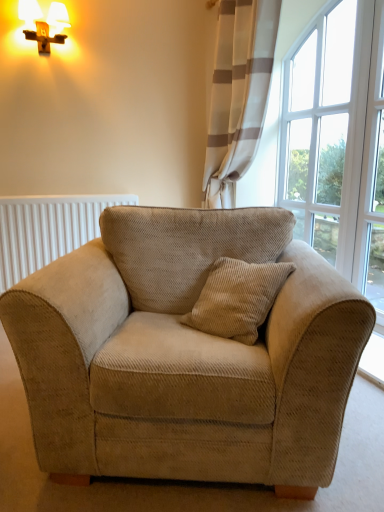
You are a GUI agent. You are given a task and a screenshot of the screen. Output one action in this format:
    pyautogui.click(x=<x>, y=<y>)
    Task: Click on the clear glass window at upper right
    The image size is (384, 512).
    Given the screenshot: What is the action you would take?
    coord(339,149)

The width and height of the screenshot is (384, 512). What do you see at coordinates (339, 149) in the screenshot?
I see `clear glass window at upper right` at bounding box center [339, 149].

What do you see at coordinates (44, 23) in the screenshot? I see `matte gold table lamp at upper left` at bounding box center [44, 23].

This screenshot has height=512, width=384. I want to click on clear glass window at upper right, so click(x=339, y=149).

Is white textured curtain at upper right outside of beige corduroy armchair at center?

Yes, white textured curtain at upper right is not within beige corduroy armchair at center.

Is white textured curtain at upper right facing away from beige corduroy armchair at center?

white textured curtain at upper right does not have its back to beige corduroy armchair at center.

From the image's perspective, is white textured curtain at upper right positioned above or below beige corduroy armchair at center?

white textured curtain at upper right is above beige corduroy armchair at center.

Locate an element on the screen. Image resolution: width=384 pixels, height=512 pixels. curtain on the right of beige corduroy armchair at center is located at coordinates (238, 94).

Measure the distance from beige corduroy armchair at center to white ribbed radiator at left.

They are 4.78 feet apart.

Is beige corduroy armchair at center taller or shorter than white ribbed radiator at left?

beige corduroy armchair at center is taller than white ribbed radiator at left.

Which object is positioned more to the right, beige corduroy armchair at center or white ribbed radiator at left?

From the viewer's perspective, beige corduroy armchair at center appears more on the right side.

From a real-world perspective, which is physically below, clear glass window at upper right or beige corduroy armchair at center?

From a 3D spatial view, beige corduroy armchair at center is below.

Is clear glass window at upper right aimed at beige corduroy armchair at center?

No, clear glass window at upper right is not turned towards beige corduroy armchair at center.

Is clear glass window at upper right shorter than beige corduroy armchair at center?

No.

Based on the photo, does white textured curtain at upper right touch clear glass window at upper right?

white textured curtain at upper right is not next to clear glass window at upper right, and they're not touching.

In terms of height, does white textured curtain at upper right look taller or shorter compared to clear glass window at upper right?

Considering their sizes, white textured curtain at upper right has less height than clear glass window at upper right.

From a real-world perspective, is white textured curtain at upper right on top of clear glass window at upper right?

Yes.

Does point (216, 152) come behind point (309, 52)?

That is True.

Considering the sizes of objects clear glass window at upper right and white textured curtain at upper right in the image provided, who is shorter, clear glass window at upper right or white textured curtain at upper right?

white textured curtain at upper right.

Is point (351, 66) positioned behind point (242, 70)?

No, (351, 66) is closer to viewer.

How far apart are clear glass window at upper right and white textured curtain at upper right?

They are 54.00 centimeters apart.

Based on their positions, is white ribbed radiator at left located to the left or right of white textured curtain at upper right?

Clearly, white ribbed radiator at left is on the left of white textured curtain at upper right in the image.

Is white ribbed radiator at left smaller than white textured curtain at upper right?

Yes.

From a real-world perspective, is white ribbed radiator at left physically above white textured curtain at upper right?

Actually, white ribbed radiator at left is physically below white textured curtain at upper right in the real world.

From the image's perspective, is white ribbed radiator at left located above or below white textured curtain at upper right?

Clearly, from the image's perspective, white ribbed radiator at left is below white textured curtain at upper right.

Is matte gold table lamp at upper left turned away from beige corduroy armchair at center?

That's not correct — matte gold table lamp at upper left is not looking away from beige corduroy armchair at center.

You are a GUI agent. You are given a task and a screenshot of the screen. Output one action in this format:
    pyautogui.click(x=<x>, y=<y>)
    Task: Click on the table lamp located above the beige corduroy armchair at center (from the image's perspective)
    Image resolution: width=384 pixels, height=512 pixels.
    Given the screenshot: What is the action you would take?
    pyautogui.click(x=44, y=23)

Looking at this image, is matte gold table lamp at upper left spatially inside beige corduroy armchair at center, or outside of it?

matte gold table lamp at upper left lies outside beige corduroy armchair at center.

Does matte gold table lamp at upper left appear on the left side of beige corduroy armchair at center?

Yes, matte gold table lamp at upper left is to the left of beige corduroy armchair at center.

I want to click on studio couch on the left of white textured curtain at upper right, so click(185, 358).

At what (x,y) coordinates should I click in order to perform the action: click on studio couch to the right of white ribbed radiator at left. Please return your answer as a coordinate pair (x, y). This screenshot has width=384, height=512. Looking at the image, I should click on (185, 358).

Based on their spatial positions, is clear glass window at upper right or white ribbed radiator at left closer to beige corduroy armchair at center?

Among the two, white ribbed radiator at left is located nearer to beige corduroy armchair at center.

Considering their positions, is white textured curtain at upper right positioned further to clear glass window at upper right than matte gold table lamp at upper left?

matte gold table lamp at upper left is further to clear glass window at upper right.

Looking at the image, which one is located further to white textured curtain at upper right, beige corduroy armchair at center or matte gold table lamp at upper left?

beige corduroy armchair at center.

Looking at the image, which one is located closer to beige corduroy armchair at center, white textured curtain at upper right or clear glass window at upper right?

clear glass window at upper right lies closer to beige corduroy armchair at center than the other object.

Looking at the image, which one is located further to matte gold table lamp at upper left, beige corduroy armchair at center or white ribbed radiator at left?

beige corduroy armchair at center lies further to matte gold table lamp at upper left than the other object.

Looking at this image, which object lies nearer to the anchor point white ribbed radiator at left, matte gold table lamp at upper left or white textured curtain at upper right?

white textured curtain at upper right is positioned closer to the anchor white ribbed radiator at left.

Considering their positions, is beige corduroy armchair at center positioned further to matte gold table lamp at upper left than clear glass window at upper right?

Among the two, beige corduroy armchair at center is located further to matte gold table lamp at upper left.

Based on their spatial positions, is matte gold table lamp at upper left or beige corduroy armchair at center closer to clear glass window at upper right?

beige corduroy armchair at center.

Where is `studio couch between matte gold table lamp at upper left and clear glass window at upper right in the horizontal direction`? This screenshot has width=384, height=512. studio couch between matte gold table lamp at upper left and clear glass window at upper right in the horizontal direction is located at coordinates (185, 358).

At what (x,y) coordinates should I click in order to perform the action: click on curtain between matte gold table lamp at upper left and clear glass window at upper right from left to right. Please return your answer as a coordinate pair (x, y). This screenshot has height=512, width=384. Looking at the image, I should click on (238, 94).

At what (x,y) coordinates should I click in order to perform the action: click on radiator located between matte gold table lamp at upper left and clear glass window at upper right in the left-right direction. Please return your answer as a coordinate pair (x, y). The height and width of the screenshot is (512, 384). Looking at the image, I should click on (47, 230).

I want to click on curtain between beige corduroy armchair at center and clear glass window at upper right in the front-back direction, so click(238, 94).